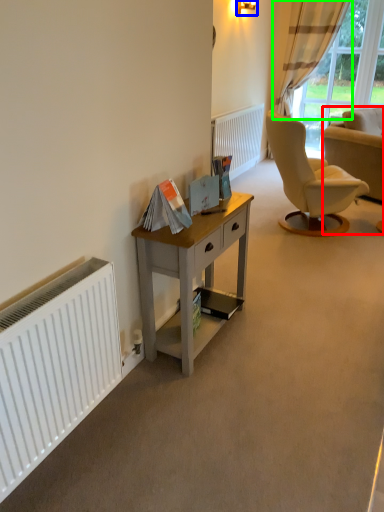
Question: Which is farther away from chair (highlighted by a red box)? lamp (highlighted by a blue box) or curtain (highlighted by a green box)?

Choices:
 (A) lamp
 (B) curtain

Answer: (B)